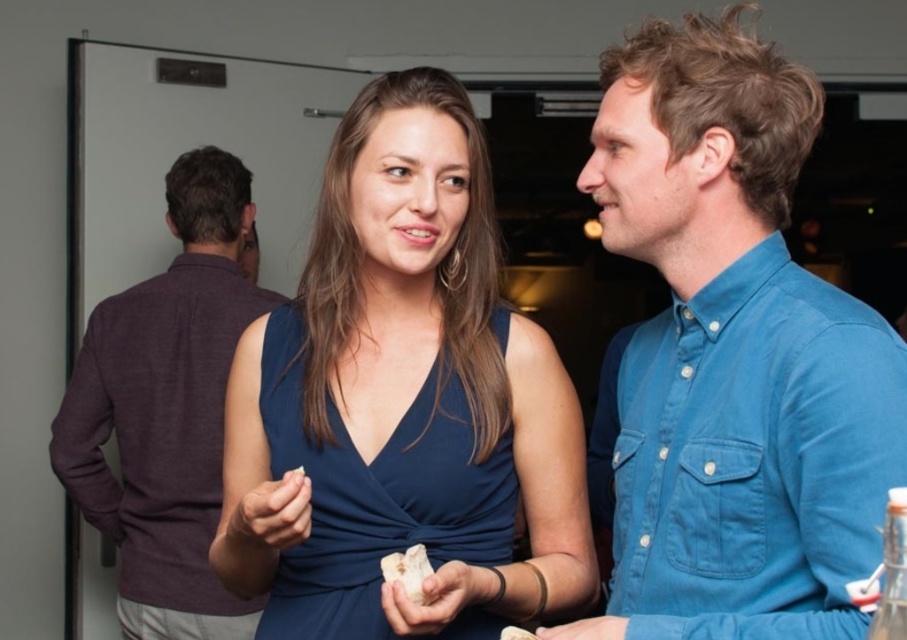
Which is in front, point (543, 522) or point (690, 192)?

Point (690, 192)

Does matte blue dress at center have a greater height compared to blue cotton shirt at upper right?

Indeed, matte blue dress at center has a greater height compared to blue cotton shirt at upper right.

Where is `matte blue dress at center`? The height and width of the screenshot is (640, 907). matte blue dress at center is located at coordinates (401, 403).

Where is `matte blue dress at center`? matte blue dress at center is located at coordinates (401, 403).

Consider the image. Is matte blue dress at center behind white crumbly bread at center?

That is False.

Does point (469, 276) come in front of point (410, 557)?

No, (469, 276) is behind (410, 557).

Who is more forward, (x=319, y=250) or (x=407, y=573)?

Point (x=407, y=573) is more forward.

Identify the location of matte blue dress at center. (401, 403).

Looking at this image, between blue cotton shirt at upper right and white crumbly bread at center, which one is positioned higher?

Positioned higher is blue cotton shirt at upper right.

Is point (754, 387) more distant than point (418, 584)?

No, it is not.

The image size is (907, 640). In order to click on blue cotton shirt at upper right in this screenshot , I will do `click(733, 356)`.